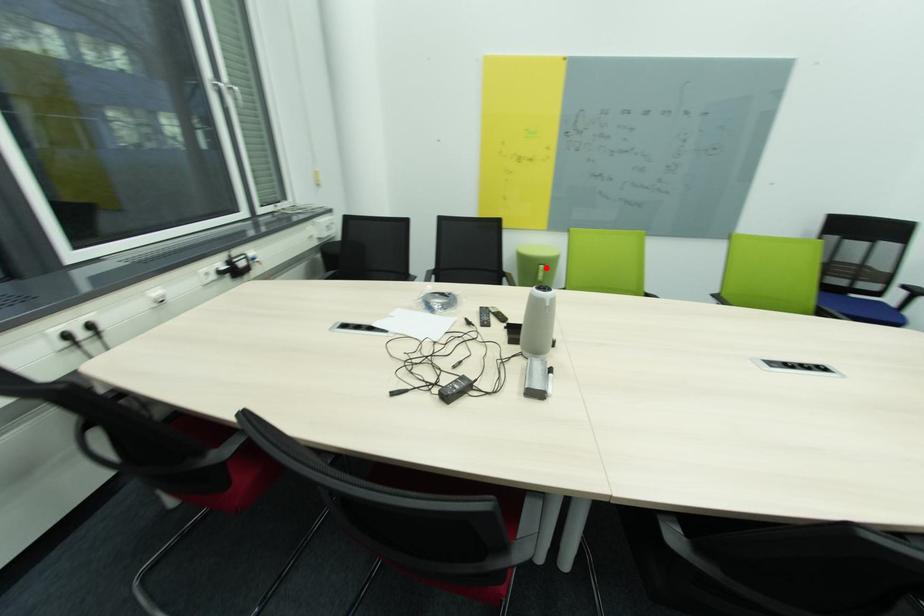
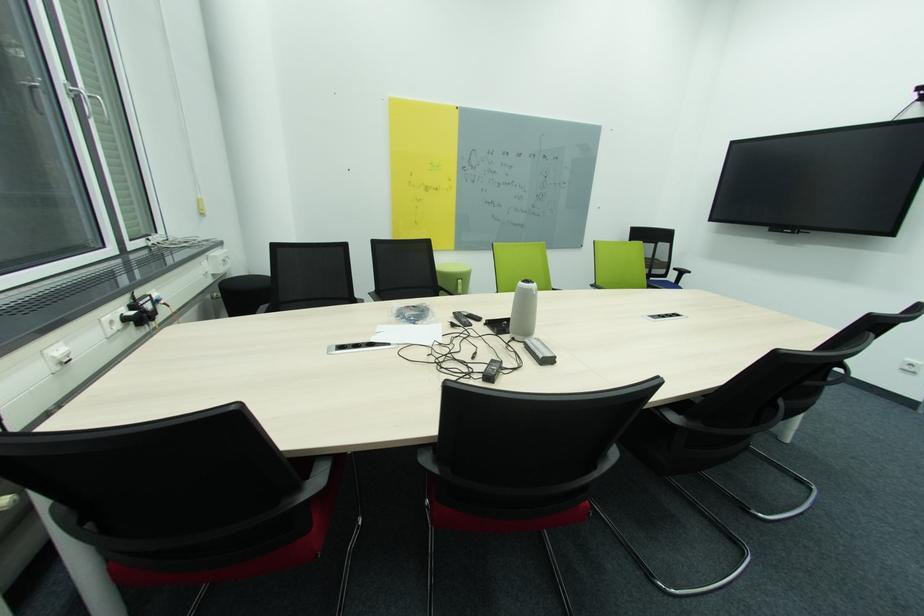
Locate, in the second image, the point that corresponds to the highlighted location in the first image.

(465, 282)